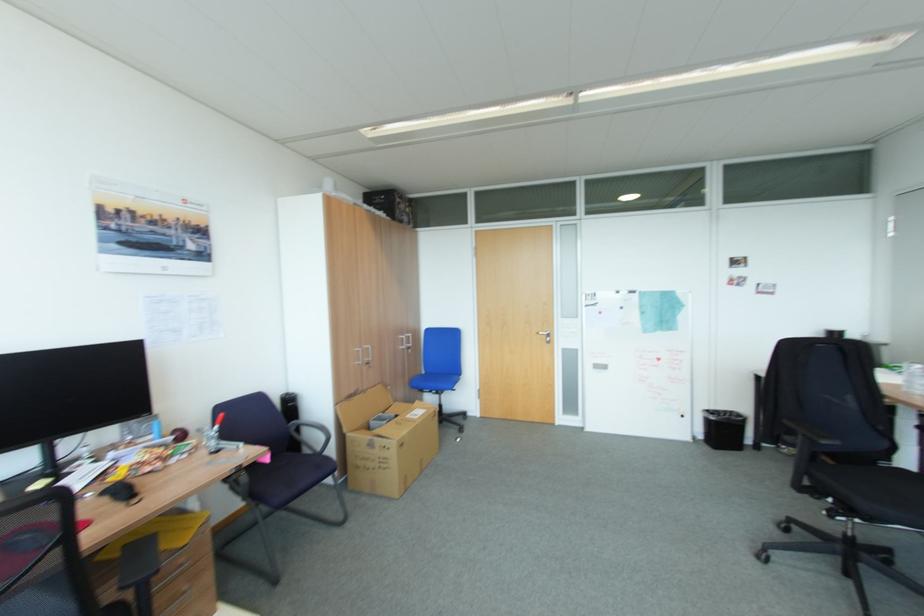
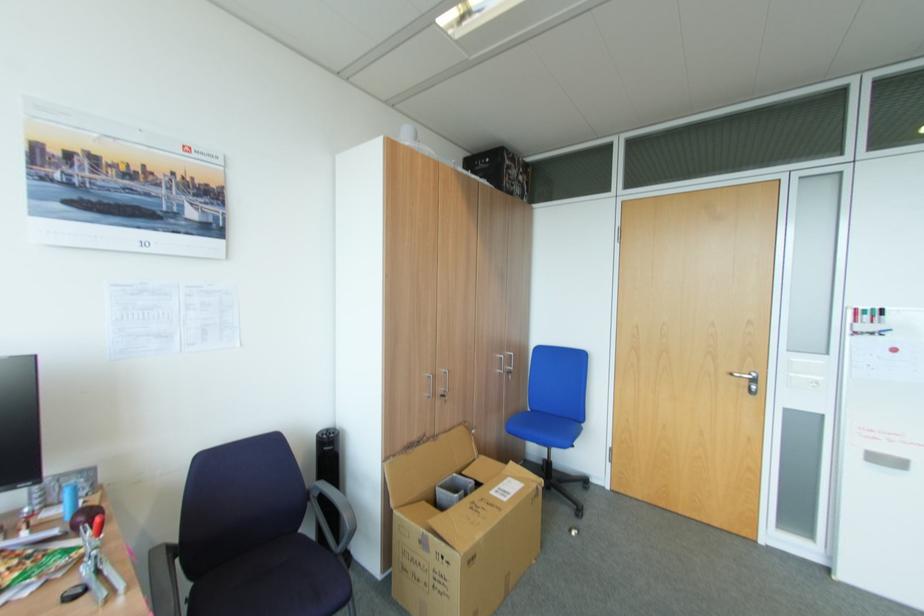
In the second image, find the point that corresponds to the point at 219,443 in the first image.

(91, 569)